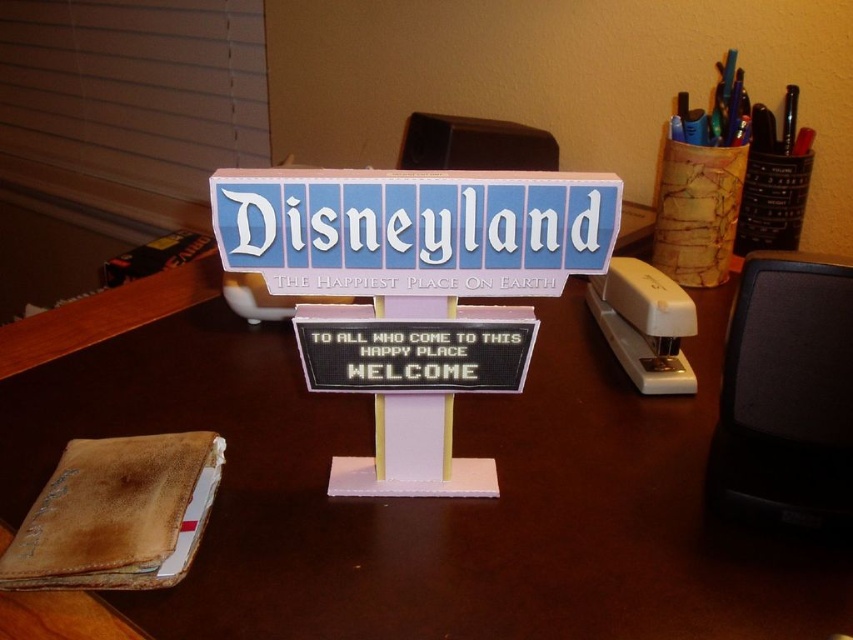
Question: Which object is positioned farthest from the blue plastic disneyland sign at center?

Choices:
 (A) metallic pen at upper right
 (B) leather wallet at lower left
 (C) white plastic stapler at right
 (D) wooden desk at center

Answer: (A)

Question: Which object appears closest to the camera in this image?

Choices:
 (A) blue plastic disneyland sign at center
 (B) metallic pen at upper right

Answer: (A)

Question: Which object is the farthest from the white plastic stapler at right?

Choices:
 (A) wooden desk at center
 (B) metallic pen at upper right

Answer: (B)

Question: Is white plastic stapler at right to the right of metallic pen at upper right from the viewer's perspective?

Choices:
 (A) yes
 (B) no

Answer: (B)

Question: Does blue plastic disneyland sign at center have a greater width compared to leather wallet at lower left?

Choices:
 (A) no
 (B) yes

Answer: (B)

Question: Is blue plastic disneyland sign at center thinner than metallic pen at upper right?

Choices:
 (A) yes
 (B) no

Answer: (B)